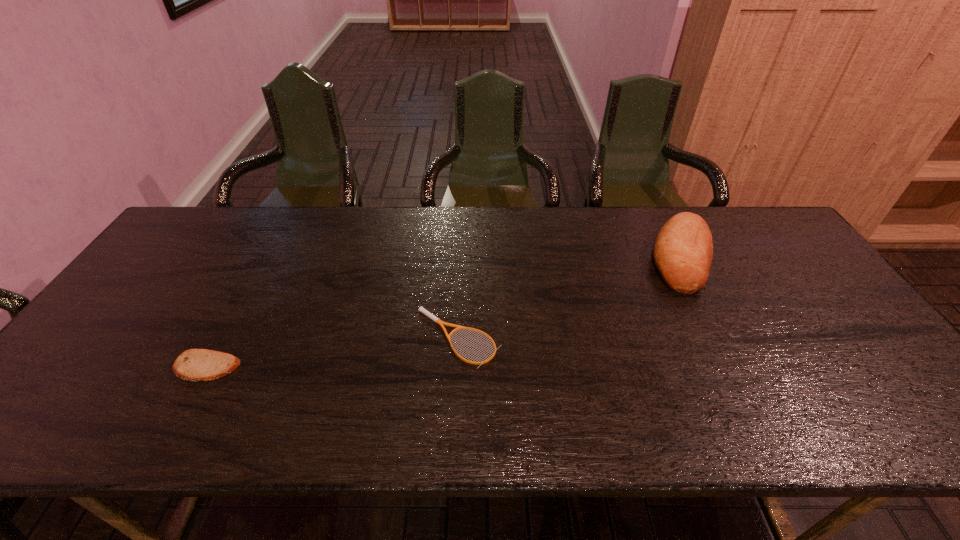
What are the coordinates of `free space that satisfies the following two spatial constraints: 1. on the back side of the pita bread; 2. on the left side of the farthest object` in the screenshot? It's located at [x=266, y=258].